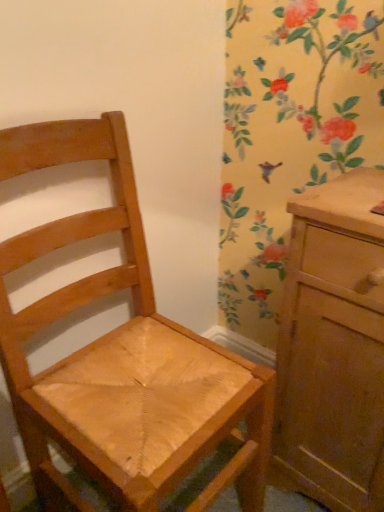
Question: Which is correct: matte wood chest of drawers at right is inside wooden chair at center, or outside of it?

Choices:
 (A) outside
 (B) inside

Answer: (A)

Question: In terms of size, does matte wood chest of drawers at right appear bigger or smaller than wooden chair at center?

Choices:
 (A) small
 (B) big

Answer: (A)

Question: In the image, is matte wood chest of drawers at right on the left side or the right side of wooden chair at center?

Choices:
 (A) left
 (B) right

Answer: (B)

Question: In terms of height, does wooden chair at center look taller or shorter compared to matte wood chest of drawers at right?

Choices:
 (A) tall
 (B) short

Answer: (A)

Question: Looking at the image, does wooden chair at center seem bigger or smaller compared to matte wood chest of drawers at right?

Choices:
 (A) big
 (B) small

Answer: (A)

Question: Relative to matte wood chest of drawers at right, is wooden chair at center in front or behind?

Choices:
 (A) behind
 (B) front

Answer: (B)

Question: In terms of width, does wooden chair at center look wider or thinner when compared to matte wood chest of drawers at right?

Choices:
 (A) thin
 (B) wide

Answer: (B)